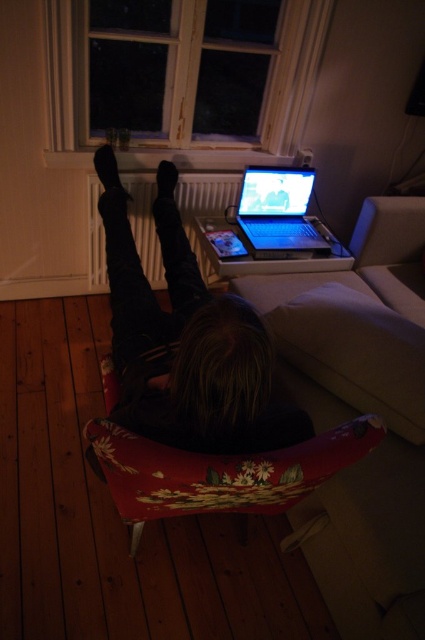
Does shiny silver laptop at center appear over black matte foot at lower center?

No.

Is shiny silver laptop at center taller than black matte foot at lower center?

Yes, shiny silver laptop at center is taller than black matte foot at lower center.

Is point (258, 189) positioned before point (158, 193)?

No, it is not.

Find the location of a particular element. The height and width of the screenshot is (640, 425). shiny silver laptop at center is located at coordinates (278, 211).

Can you confirm if white fabric couch at center is thinner than dark hair at center?

In fact, white fabric couch at center might be wider than dark hair at center.

Can you confirm if white fabric couch at center is taller than dark hair at center?

Yes, white fabric couch at center is taller than dark hair at center.

Does point (416, 552) come behind point (139, 262)?

No, it is in front of (139, 262).

Image resolution: width=425 pixels, height=640 pixels. I want to click on white fabric couch at center, so [362, 412].

Between white fabric couch at center and shiny silver laptop at center, which one appears on the right side from the viewer's perspective?

Positioned to the right is white fabric couch at center.

Who is shorter, white fabric couch at center or shiny silver laptop at center?

Standing shorter between the two is shiny silver laptop at center.

Is point (331, 349) closer to viewer compared to point (306, 240)?

That is True.

Where is `white fabric couch at center`? white fabric couch at center is located at coordinates (362, 412).